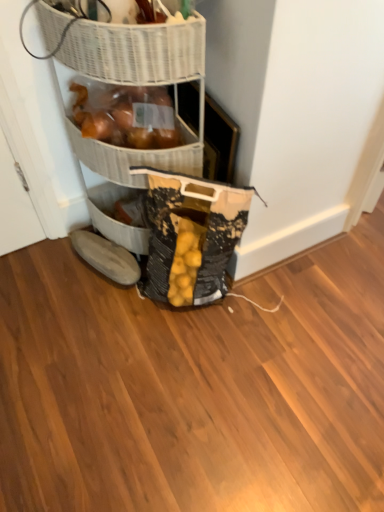
I want to click on vacant region above brown suede boot at lower left (from a real-world perspective), so click(106, 250).